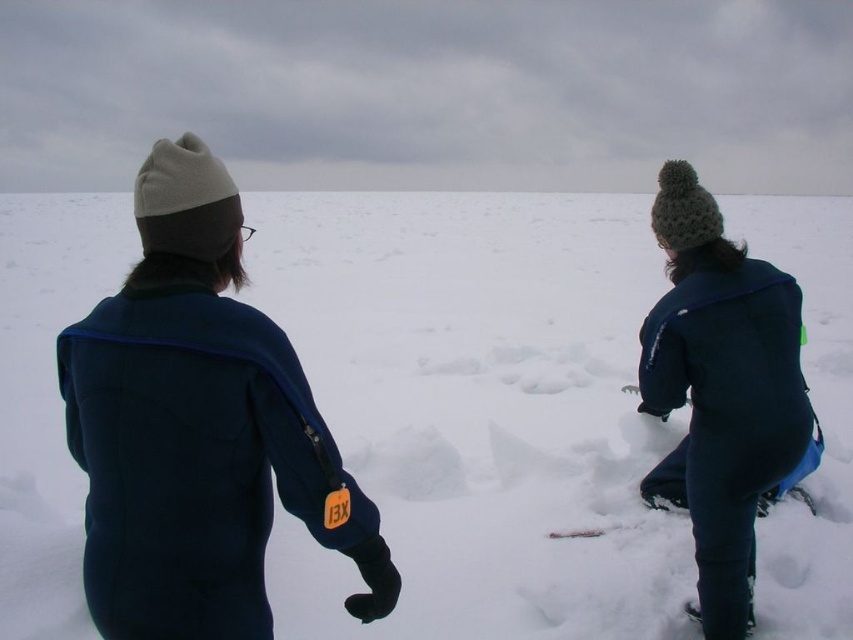
Which of these two, dark blue fleece jacket at upper left or dark blue fleece jacket at right, stands taller?

Standing taller between the two is dark blue fleece jacket at right.

This screenshot has width=853, height=640. I want to click on dark blue fleece jacket at upper left, so click(x=198, y=428).

Is point (207, 634) positioned in front of point (708, 294)?

Yes, point (207, 634) is in front of point (708, 294).

I want to click on dark blue fleece jacket at upper left, so click(x=198, y=428).

Image resolution: width=853 pixels, height=640 pixels. What are the coordinates of `white fluffy snow at center` in the screenshot? It's located at (477, 410).

Is white fluffy snow at center to the right of dark blue fleece jacket at right from the viewer's perspective?

Yes, white fluffy snow at center is to the right of dark blue fleece jacket at right.

Locate an element on the screen. This screenshot has width=853, height=640. white fluffy snow at center is located at coordinates [x=477, y=410].

The image size is (853, 640). What are the coordinates of `white fluffy snow at center` in the screenshot? It's located at (477, 410).

Where is `white fluffy snow at center`? The height and width of the screenshot is (640, 853). white fluffy snow at center is located at coordinates (477, 410).

Is white fluffy snow at center further to camera compared to dark blue fleece jacket at upper left?

Yes, white fluffy snow at center is further from the viewer.

Who is more distant from viewer, (474, 552) or (105, 486)?

Point (474, 552)

Identify the location of white fluffy snow at center. (477, 410).